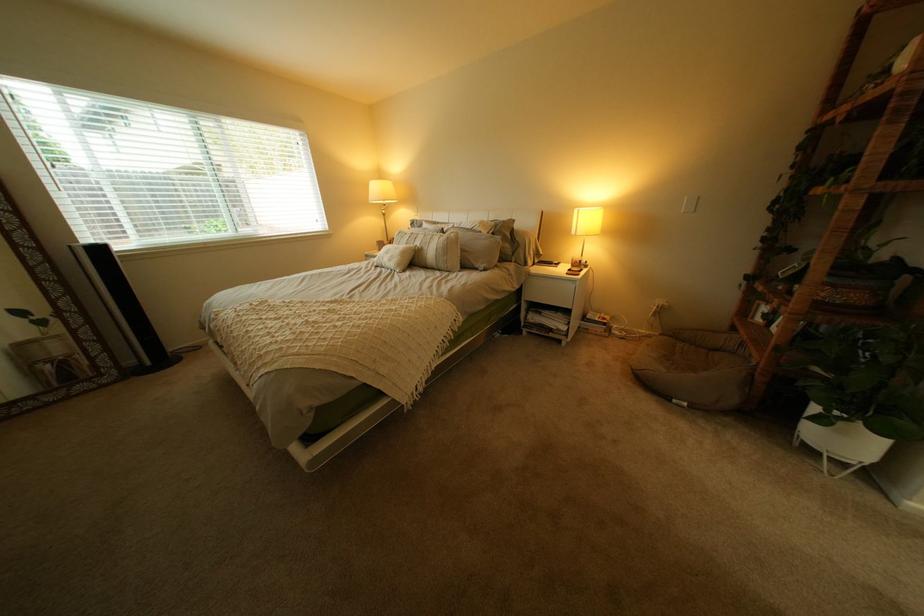
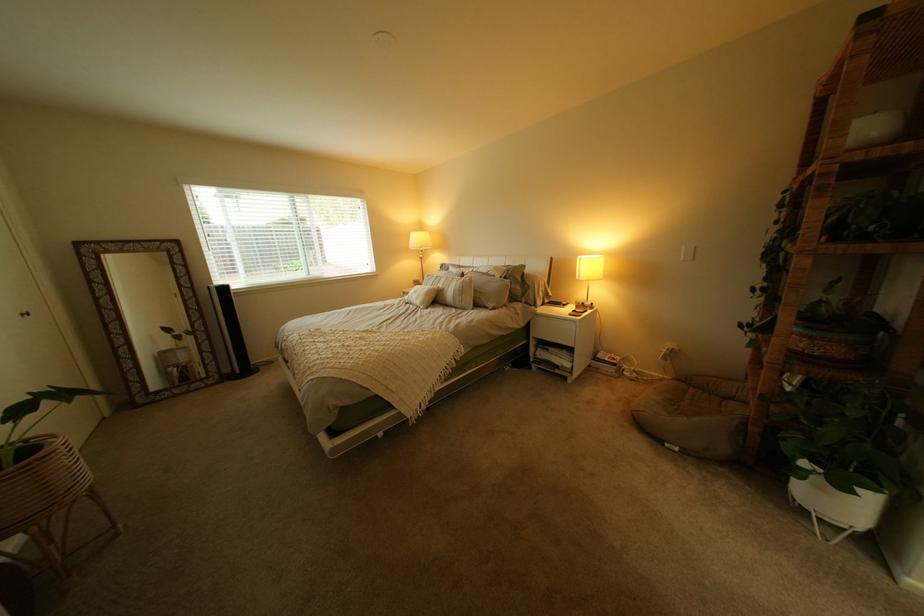
The point at (441, 249) is marked in the first image. Where is the corresponding point in the second image?

(462, 290)